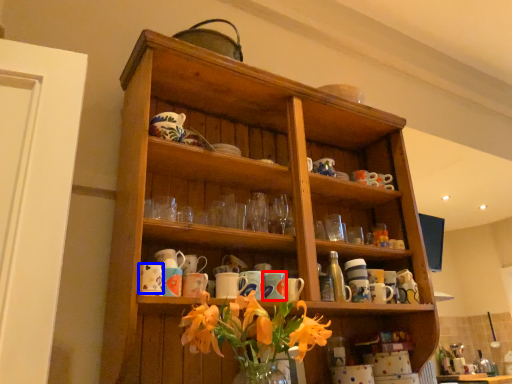
Question: Which object is closer to the camera taking this photo, mug (highlighted by a red box) or mug (highlighted by a blue box)?

Choices:
 (A) mug
 (B) mug

Answer: (B)